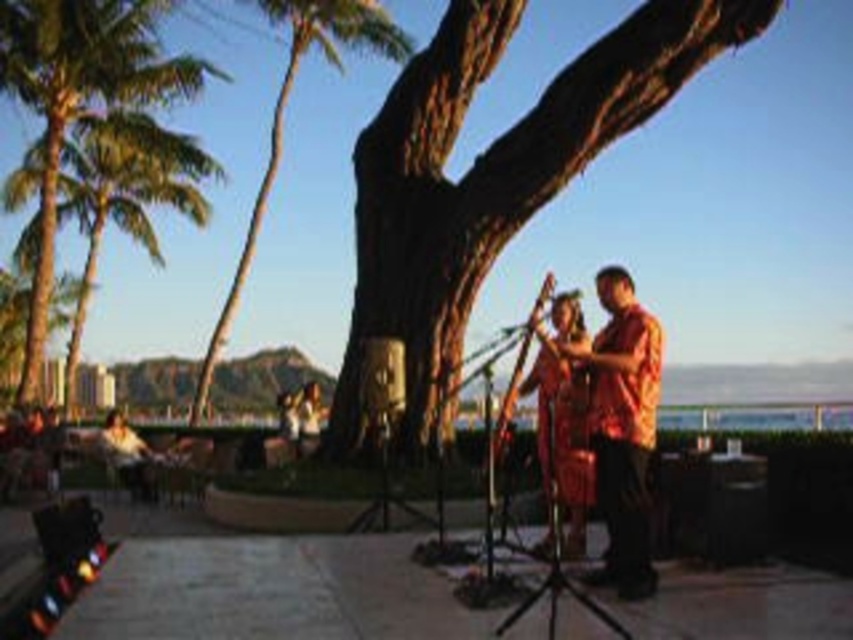
You are an artist planning to paint the scene. You want to ensure the green leafy palm tree at upper left and the matte black jacket at lower left are proportionally accurate. Which object should you draw wider?

The green leafy palm tree at upper left should be drawn wider because its width surpasses that of the matte black jacket at lower left according to the description.